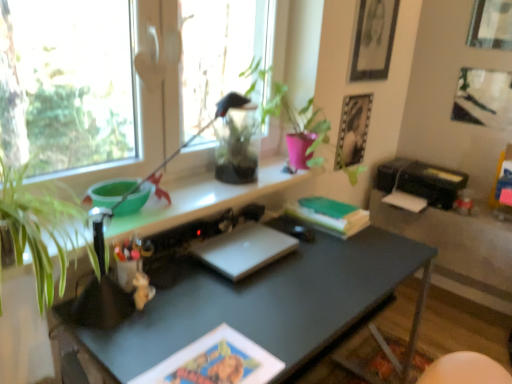
You are a GUI agent. You are given a task and a screenshot of the screen. Output one action in this format:
    pyautogui.click(x=<x>, y=<y>)
    Task: Click on the free space above black plastic table at lower right (from a real-world perspective)
    
    Given the screenshot: What is the action you would take?
    pyautogui.click(x=482, y=212)